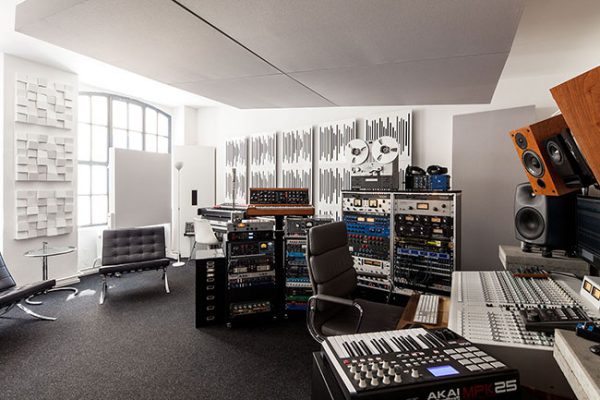
I want to click on artwork, so click(236, 151), click(260, 156), click(296, 153), click(325, 141), click(380, 128).